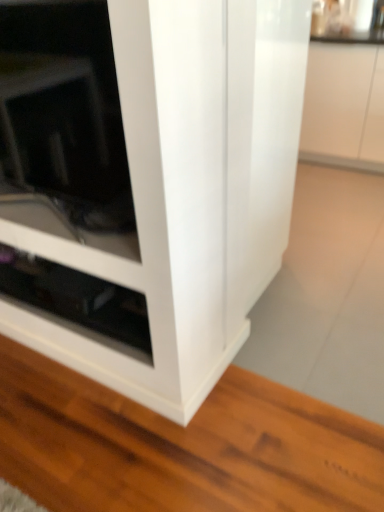
This screenshot has height=512, width=384. I want to click on black glossy drawer at lower left, so click(76, 298).

This screenshot has width=384, height=512. What do you see at coordinates (76, 298) in the screenshot?
I see `black glossy drawer at lower left` at bounding box center [76, 298].

Find the location of a particular element. The image size is (384, 512). black glossy drawer at lower left is located at coordinates (76, 298).